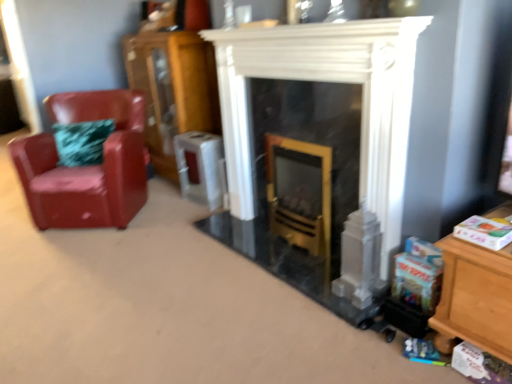
Question: From a real-world perspective, is wooden cabinet at left positioned above or below glossy leather chair at left?

Choices:
 (A) below
 (B) above

Answer: (B)

Question: Considering the relative positions of wooden cabinet at left and glossy leather chair at left in the image provided, is wooden cabinet at left to the left or to the right of glossy leather chair at left?

Choices:
 (A) left
 (B) right

Answer: (B)

Question: Which of these objects is positioned farthest from the wooden cabinet at left?

Choices:
 (A) white marble fireplace at center
 (B) glossy leather chair at left

Answer: (A)

Question: Estimate the real-world distances between objects in this image. Which object is closer to the wooden cabinet at left?

Choices:
 (A) white marble fireplace at center
 (B) glossy leather chair at left

Answer: (B)